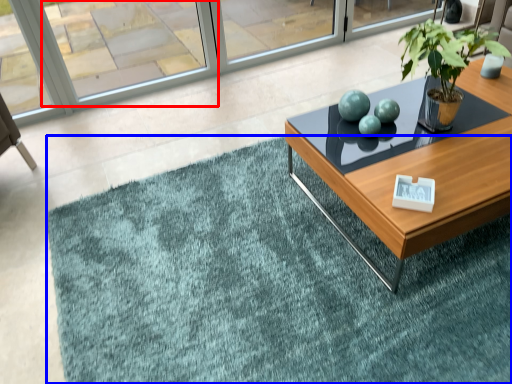
Question: Which object appears farthest to the camera in this image, window (highlighted by a red box) or doormat (highlighted by a blue box)?

Choices:
 (A) window
 (B) doormat

Answer: (A)